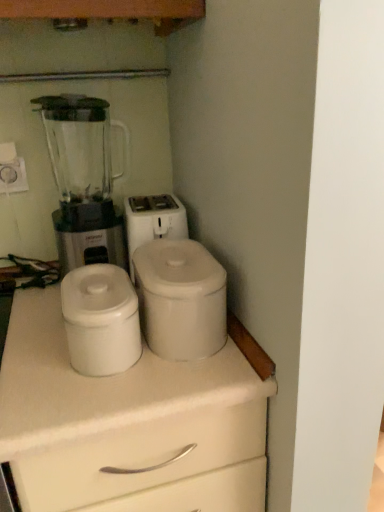
Question: Does white matte container at center, which is the first appliance from left to right, appear on the left side of white matte chest of drawers at center?

Choices:
 (A) no
 (B) yes

Answer: (A)

Question: Considering the relative sizes of white matte container at center, which is the first appliance from left to right, and white matte chest of drawers at center in the image provided, is white matte container at center, which is the first appliance from left to right, wider than white matte chest of drawers at center?

Choices:
 (A) yes
 (B) no

Answer: (B)

Question: Can you confirm if white matte container at center, which is the first appliance from left to right, is positioned to the right of white matte chest of drawers at center?

Choices:
 (A) yes
 (B) no

Answer: (A)

Question: From the image's perspective, is white matte container at center, which is the second appliance from right to left, beneath white matte chest of drawers at center?

Choices:
 (A) no
 (B) yes

Answer: (A)

Question: Could you tell me if white matte container at center, which is the second appliance from right to left, is turned towards white matte chest of drawers at center?

Choices:
 (A) yes
 (B) no

Answer: (B)

Question: Is white matte container at center, which is the first appliance from left to right, next to white matte chest of drawers at center?

Choices:
 (A) yes
 (B) no

Answer: (B)

Question: Does transparent plastic blender at left have a smaller size compared to white matte container at center, which is the first appliance from left to right?

Choices:
 (A) no
 (B) yes

Answer: (A)

Question: From a real-world perspective, is transparent plastic blender at left under white matte container at center, which is the first appliance from left to right?

Choices:
 (A) yes
 (B) no

Answer: (B)

Question: Is transparent plastic blender at left further to the viewer compared to white matte container at center, which is the first appliance from left to right?

Choices:
 (A) yes
 (B) no

Answer: (A)

Question: Is transparent plastic blender at left not inside white matte container at center, which is the first appliance from left to right?

Choices:
 (A) no
 (B) yes

Answer: (B)

Question: Does transparent plastic blender at left have a greater width compared to white matte container at center, which is the second appliance from right to left?

Choices:
 (A) yes
 (B) no

Answer: (A)

Question: From the image's perspective, is transparent plastic blender at left on top of white matte container at center, which is the first appliance from left to right?

Choices:
 (A) no
 (B) yes

Answer: (B)

Question: Considering the relative sizes of white matte chest of drawers at center and transparent plastic blender at left in the image provided, is white matte chest of drawers at center shorter than transparent plastic blender at left?

Choices:
 (A) no
 (B) yes

Answer: (A)